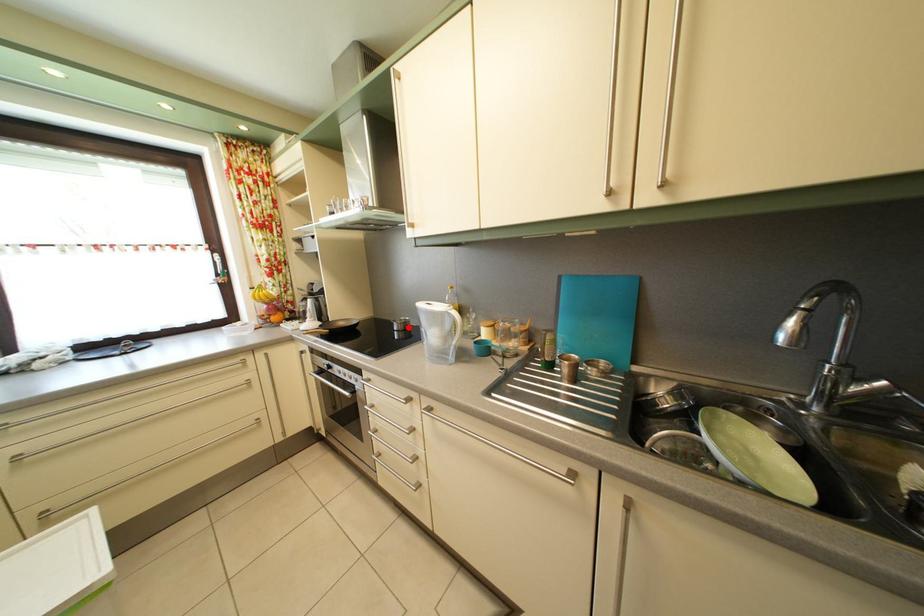
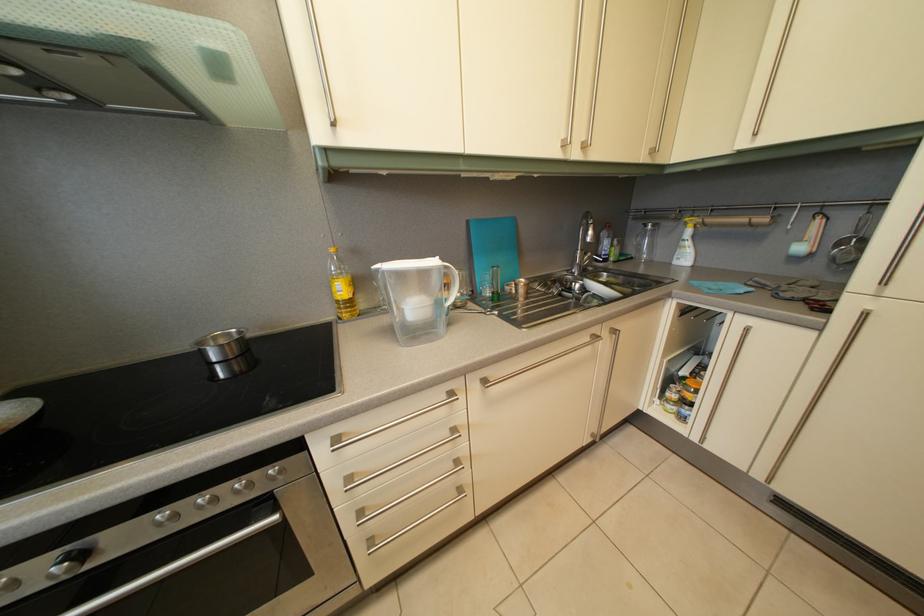
Question: I am providing you with two images of the same scene from different viewpoints. In image1, a red point is highlighted. Considering the same 3D point in image2, which of the following is correct?

Choices:
 (A) It is closer
 (B) It is farther

Answer: (A)